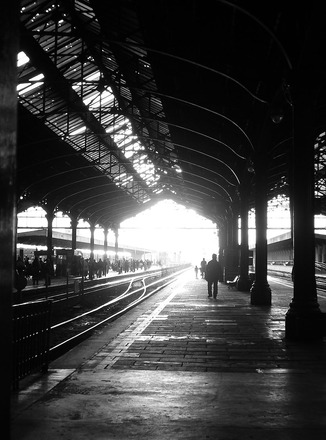
Locate an element on the screen. The image size is (326, 440). bright light is located at coordinates click(x=170, y=235).